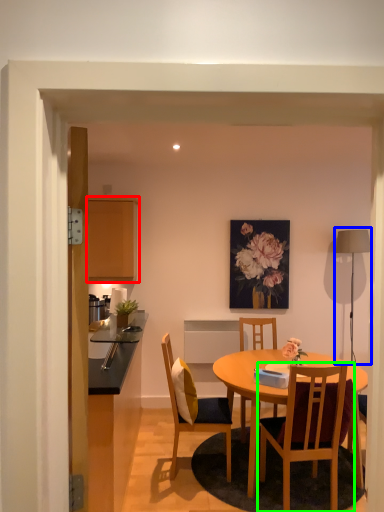
Question: Which is farther away from cabinetry (highlighted by a red box)? lamp (highlighted by a blue box) or chair (highlighted by a green box)?

Choices:
 (A) lamp
 (B) chair

Answer: (A)